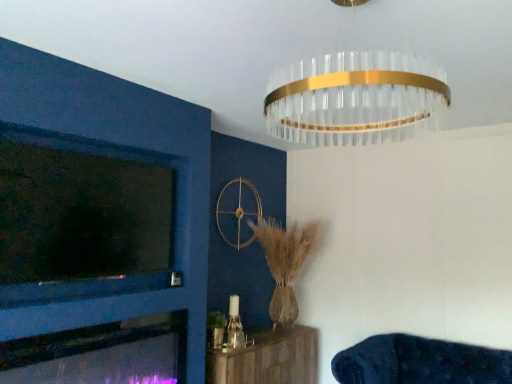
Question: Is dark blue plush couch at lower right, marked as the 2th furniture in a left-to-right arrangement, directly adjacent to wooden shelf at lower center, which ranks as the 1th furniture in left-to-right order?

Choices:
 (A) yes
 (B) no

Answer: (B)

Question: Is dark blue plush couch at lower right, which ranks as the 1th furniture in right-to-left order, aimed at wooden shelf at lower center, placed as the 2th furniture when sorted from right to left?

Choices:
 (A) yes
 (B) no

Answer: (B)

Question: Is dark blue plush couch at lower right, which ranks as the 1th furniture in right-to-left order, to the right of wooden shelf at lower center, placed as the 2th furniture when sorted from right to left, from the viewer's perspective?

Choices:
 (A) no
 (B) yes

Answer: (B)

Question: Considering the relative sizes of dark blue plush couch at lower right, which ranks as the 1th furniture in right-to-left order, and wooden shelf at lower center, which ranks as the 1th furniture in left-to-right order, in the image provided, is dark blue plush couch at lower right, which ranks as the 1th furniture in right-to-left order, thinner than wooden shelf at lower center, which ranks as the 1th furniture in left-to-right order,?

Choices:
 (A) yes
 (B) no

Answer: (B)

Question: Can you confirm if dark blue plush couch at lower right, marked as the 2th furniture in a left-to-right arrangement, is bigger than wooden shelf at lower center, placed as the 2th furniture when sorted from right to left?

Choices:
 (A) no
 (B) yes

Answer: (B)

Question: From a real-world perspective, is dark blue plush couch at lower right, which ranks as the 1th furniture in right-to-left order, positioned over wooden shelf at lower center, placed as the 2th furniture when sorted from right to left, based on gravity?

Choices:
 (A) yes
 (B) no

Answer: (A)

Question: Is wooden shelf at lower center, placed as the 2th furniture when sorted from right to left, further to the viewer compared to clear glass chandelier at upper center?

Choices:
 (A) yes
 (B) no

Answer: (A)

Question: Is the depth of wooden shelf at lower center, placed as the 2th furniture when sorted from right to left, less than that of clear glass chandelier at upper center?

Choices:
 (A) yes
 (B) no

Answer: (B)

Question: From the image's perspective, does wooden shelf at lower center, which ranks as the 1th furniture in left-to-right order, appear lower than clear glass chandelier at upper center?

Choices:
 (A) no
 (B) yes

Answer: (B)

Question: Does wooden shelf at lower center, which ranks as the 1th furniture in left-to-right order, have a greater width compared to clear glass chandelier at upper center?

Choices:
 (A) yes
 (B) no

Answer: (B)

Question: Is wooden shelf at lower center, which ranks as the 1th furniture in left-to-right order, directly adjacent to clear glass chandelier at upper center?

Choices:
 (A) yes
 (B) no

Answer: (B)

Question: From a real-world perspective, is wooden shelf at lower center, placed as the 2th furniture when sorted from right to left, physically above clear glass chandelier at upper center?

Choices:
 (A) no
 (B) yes

Answer: (A)

Question: Would you consider clear glass chandelier at upper center to be distant from matte glass fireplace at lower left?

Choices:
 (A) no
 (B) yes

Answer: (B)